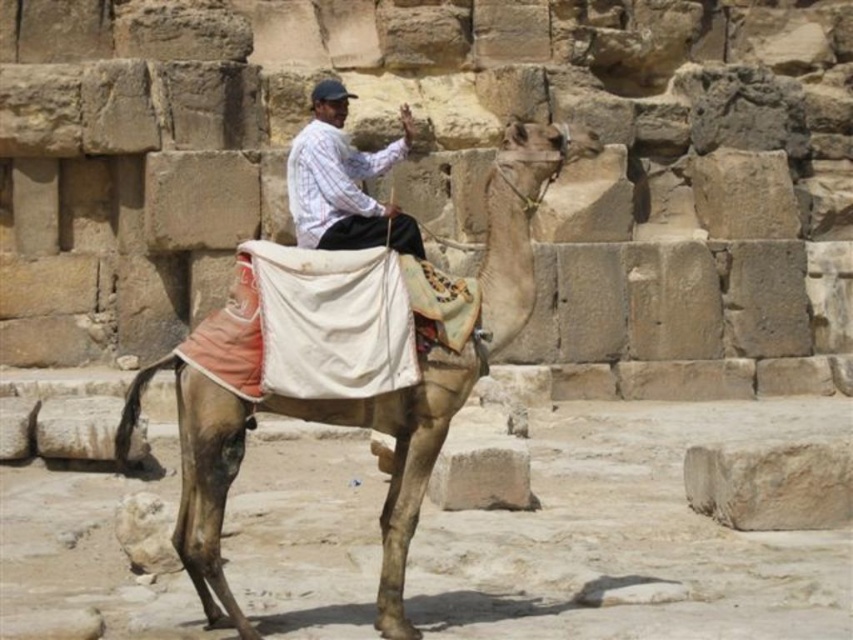
You are a traveler standing in front of the ancient stone ruins. You see a brown textured camel at center and a white striped shirt at center. Which object is located to the left of the other?

The white striped shirt at center is located to the left of the brown textured camel at center because the brown textured camel at center is positioned on the right side of the white striped shirt at center.

You are a traveler standing next to the brown textured camel at center and want to reach the white striped shirt at center. Can you walk directly to it without needing to move the camel?

The distance between the brown textured camel at center and the white striped shirt at center is 4.90 meters, so yes, you can walk directly to the white striped shirt at center without needing to move the camel since the distance is sufficient for walking.

You are a traveler standing in front of the ancient stone ruins. You see a brown textured camel at center and a white striped shirt at center. Which object is taller?

The brown textured camel at center is much taller than the white striped shirt at center.